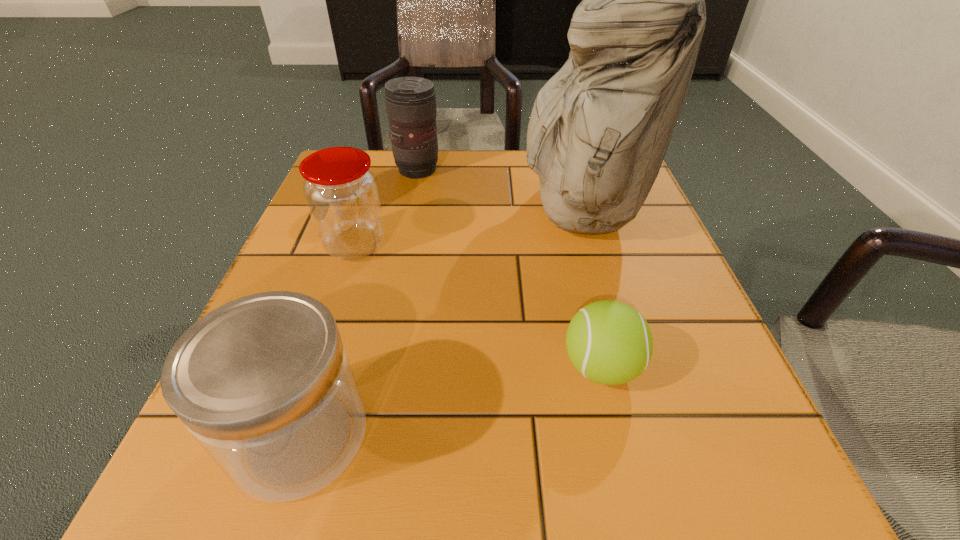
At what (x,y) coordinates should I click in order to perform the action: click on object at the far right corner. Please return your answer as a coordinate pair (x, y). The width and height of the screenshot is (960, 540). Looking at the image, I should click on point(600,127).

At what (x,y) coordinates should I click in order to perform the action: click on vacant region at the far edge of the desktop. Please return your answer as a coordinate pair (x, y). The width and height of the screenshot is (960, 540). Looking at the image, I should click on (457, 154).

The image size is (960, 540). What are the coordinates of `vacant point at the near edge` in the screenshot? It's located at (372, 459).

Where is `vacant space at the left edge of the desktop`? vacant space at the left edge of the desktop is located at coordinates (351, 338).

Image resolution: width=960 pixels, height=540 pixels. In order to click on free space at the right edge in this screenshot , I will do `click(640, 249)`.

I want to click on vacant point at the far left corner, so click(x=391, y=158).

Image resolution: width=960 pixels, height=540 pixels. Find the location of `vacant space at the near left corner of the desktop`. vacant space at the near left corner of the desktop is located at coordinates click(x=191, y=453).

I want to click on free spot between the tallest object and the nearer jar, so click(441, 322).

Where is `vacant region between the backpack and the telephoto lens`? The image size is (960, 540). vacant region between the backpack and the telephoto lens is located at coordinates (499, 190).

Locate an element on the screen. free space between the nearer jar and the tallest object is located at coordinates (441, 322).